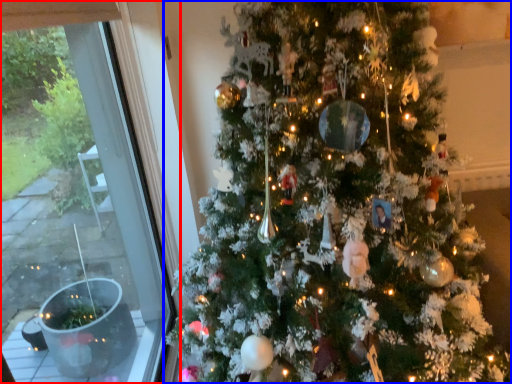
Question: Which object appears farthest to the camera in this image, window (highlighted by a red box) or christmas tree (highlighted by a blue box)?

Choices:
 (A) window
 (B) christmas tree

Answer: (A)